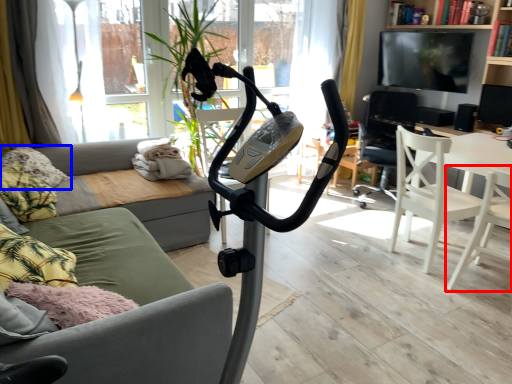
Question: Which point is further to the camera, chair (highlighted by a red box) or pillow (highlighted by a blue box)?

Choices:
 (A) chair
 (B) pillow

Answer: (B)